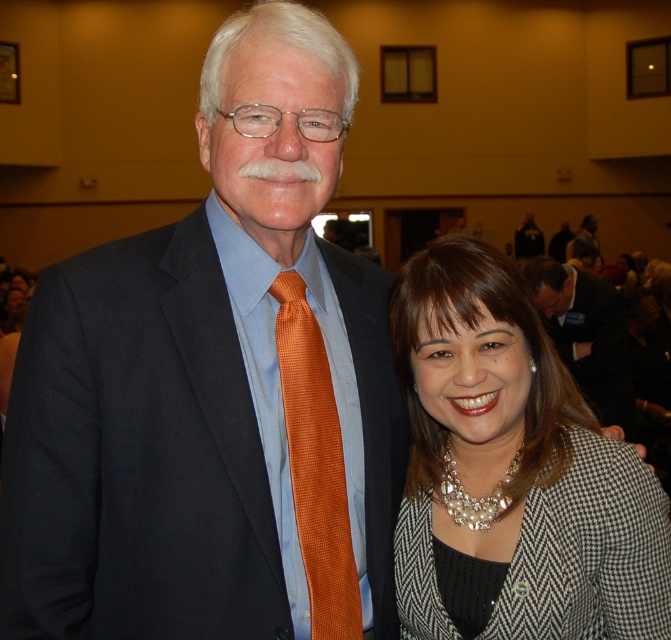
Which of these two, matte orange tie at center or matte black suit at center, stands shorter?

With less height is matte black suit at center.

Which is behind, point (250, 189) or point (535, 228)?

Point (535, 228)

Between point (160, 355) and point (515, 234), which one is positioned behind?

The point (515, 234) is more distant.

At what (x,y) coordinates should I click in order to perform the action: click on matte orange tie at center. Please return your answer as a coordinate pair (x, y). Looking at the image, I should click on (213, 388).

Is matte orange tie at center smaller than silver textured necklace at center?

Actually, matte orange tie at center might be larger than silver textured necklace at center.

Between point (99, 596) and point (615, 524), which one is positioned in front?

Point (99, 596)

Identify the location of matte orange tie at center. Image resolution: width=671 pixels, height=640 pixels. (213, 388).

Can you confirm if orange silk tie at center is positioned to the right of matte black suit at center?

In fact, orange silk tie at center is to the left of matte black suit at center.

Does point (344, 630) lie behind point (539, 230)?

No, (344, 630) is in front of (539, 230).

Does point (297, 394) lie behind point (521, 252)?

That is False.

You are a GUI agent. You are given a task and a screenshot of the screen. Output one action in this format:
    pyautogui.click(x=<x>, y=<y>)
    Task: Click on the orange silk tie at center
    
    Given the screenshot: What is the action you would take?
    pyautogui.click(x=315, y=465)